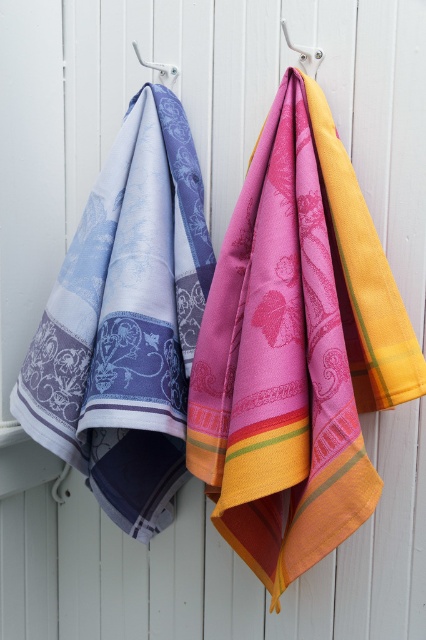
Locate an element on the screen. matte blue and purple fabric at left is located at coordinates (126, 323).

Is point (104, 289) closer to viewer compared to point (299, 54)?

No, it is behind (299, 54).

Does point (154, 365) come closer to viewer compared to point (311, 58)?

Yes.

Locate an element on the screen. The width and height of the screenshot is (426, 640). matte blue and purple fabric at left is located at coordinates (126, 323).

How far apart are pink woven towel at center and white plastic hook at upper right?

19.71 inches

Is point (276, 204) positioned in front of point (308, 68)?

Yes, point (276, 204) is closer to viewer.

What do you see at coordinates (279, 369) in the screenshot? I see `pink woven towel at center` at bounding box center [279, 369].

You are a GUI agent. You are given a task and a screenshot of the screen. Output one action in this format:
    pyautogui.click(x=<x>, y=<y>)
    Task: Click on the pink woven towel at center
    Image resolution: width=426 pixels, height=640 pixels.
    Given the screenshot: What is the action you would take?
    pyautogui.click(x=279, y=369)

Is point (264, 225) closer to camera compared to point (150, 260)?

Yes.

Does pink woven towel at center have a smaller size compared to matte blue and purple fabric at left?

Indeed, pink woven towel at center has a smaller size compared to matte blue and purple fabric at left.

Who is more distant from viewer, [276,376] or [178,156]?

Positioned behind is point [178,156].

Locate an element on the screen. This screenshot has height=640, width=426. pink woven towel at center is located at coordinates (279, 369).